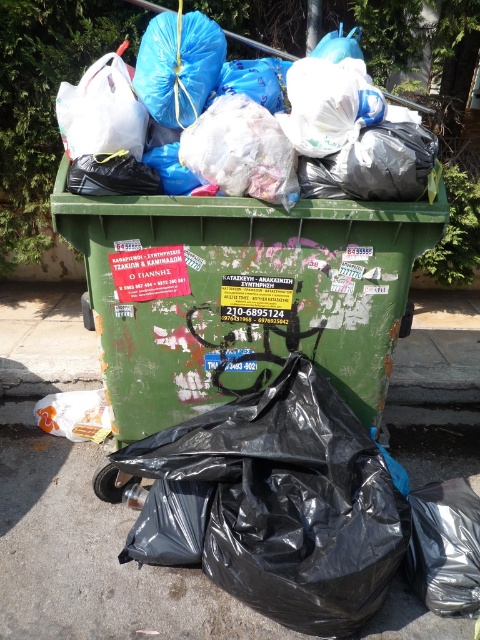
Question: Can you confirm if blue plastic bag at upper center is positioned above white plastic bag at upper left?

Choices:
 (A) no
 (B) yes

Answer: (B)

Question: Is green matte/recycled plastic recycling bin at center closer to camera compared to white plastic bag at upper left?

Choices:
 (A) yes
 (B) no

Answer: (B)

Question: Among these points, which one is nearest to the camera?

Choices:
 (A) (84, 147)
 (B) (90, 76)
 (C) (418, 444)
 (D) (437, 184)

Answer: (A)

Question: Which object is closer to the camera taking this photo?

Choices:
 (A) blue plastic bag at upper center
 (B) gray concrete pavement at lower center
 (C) white plastic bag at upper left

Answer: (A)

Question: Which object is the closest to the white plastic bag at upper left?

Choices:
 (A) blue plastic bag at upper center
 (B) green matte/recycled plastic recycling bin at center

Answer: (A)

Question: Observing the image, what is the correct spatial positioning of gray concrete pavement at lower center in reference to blue plastic bag at upper center?

Choices:
 (A) below
 (B) above

Answer: (A)